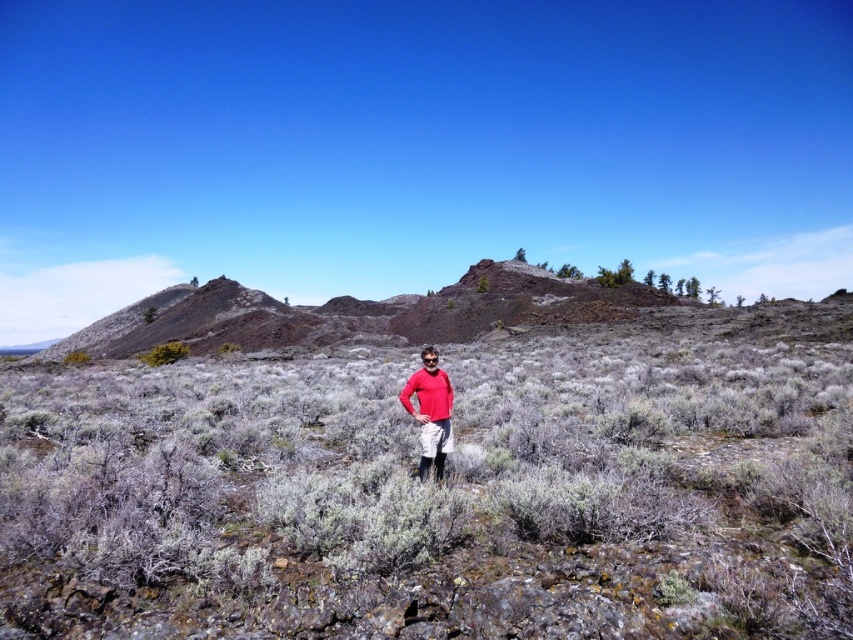
Question: Is matte red shirt at center thinner than green shrub at left?

Choices:
 (A) yes
 (B) no

Answer: (A)

Question: Which point is closer to the camera?

Choices:
 (A) matte red shirt at center
 (B) green shrub at left

Answer: (A)

Question: Does matte red shirt at center appear on the right side of green shrub at left?

Choices:
 (A) yes
 (B) no

Answer: (A)

Question: Does matte red shirt at center come in front of green shrub at left?

Choices:
 (A) yes
 (B) no

Answer: (A)

Question: Among these points, which one is nearest to the camera?

Choices:
 (A) (158, 352)
 (B) (442, 401)

Answer: (B)